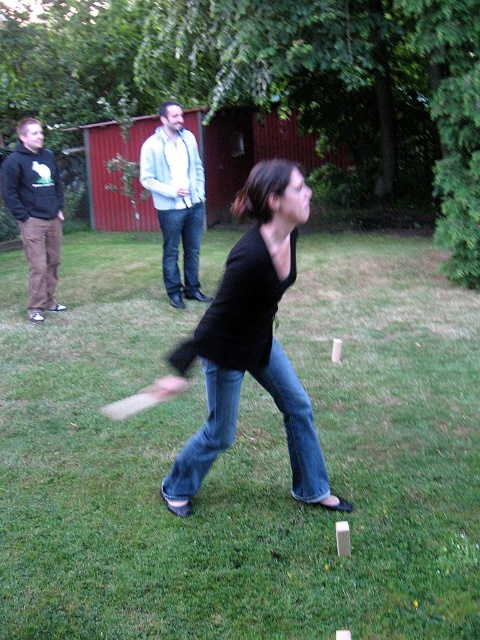
You are standing in the kubb game area and want to place a new kubb. The two points you are considering are point (33,252) and point (171,250). Which point is closer to you?

Point (33,252) is closer to the viewer than point (171,250).

You are a photographer setting up a shoot in the scene described. You want to ensure the green grass at center is visible beneath the black matte shirt at center. Is this possible given their positions?

The green grass at center is positioned under the black matte shirt at center, so yes, the grass is visible beneath the shirt.

You are a photographer taking a picture of the woman playing kubb. You want to ensure the black matte shirt at center and light blue denim jeans at center are both in focus. Which object should you focus on first to ensure both are sharp?

You should focus on the black matte shirt at center first since it is closer to the viewer than the light blue denim jeans at center, ensuring both will be in focus if the depth of field is sufficient.